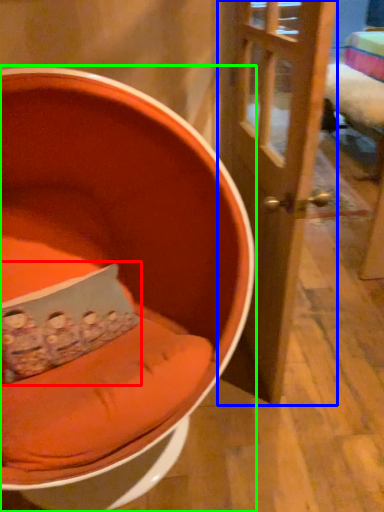
Question: Which object is positioned closest to pillow (highlighted by a red box)? Select from door (highlighted by a blue box) and chair (highlighted by a green box).

Choices:
 (A) door
 (B) chair

Answer: (B)